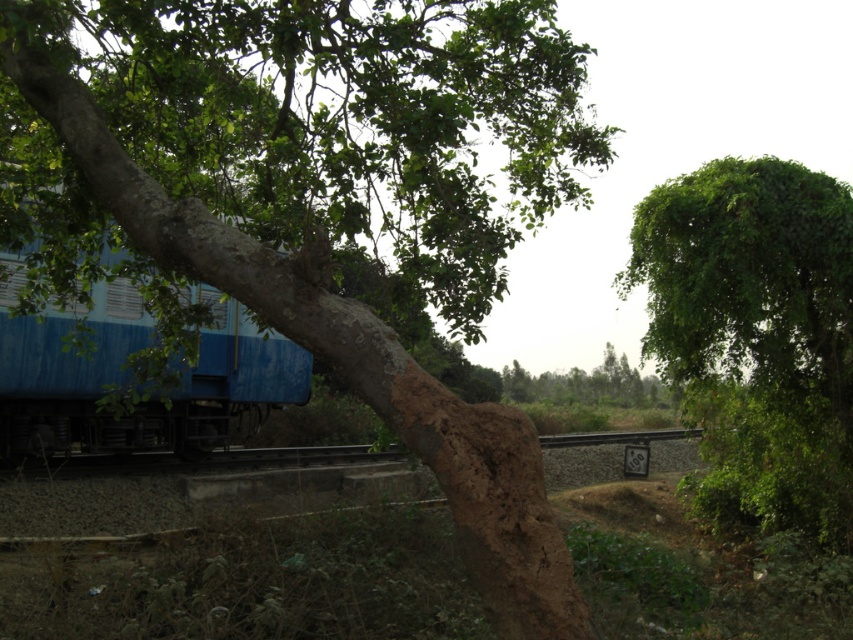
Question: Which object appears closest to the camera in this image?

Choices:
 (A) green leafy tree at upper right
 (B) brown rough bark tree at center

Answer: (B)

Question: Does brown rough bark tree at center have a larger size compared to green leafy tree at upper right?

Choices:
 (A) yes
 (B) no

Answer: (A)

Question: Which object is closer to the camera taking this photo?

Choices:
 (A) green leafy tree at upper right
 (B) blue matte train at left

Answer: (A)

Question: Is green leafy tree at upper right to the left of blue matte train at left from the viewer's perspective?

Choices:
 (A) no
 (B) yes

Answer: (A)

Question: Where is green leafy tree at upper right located in relation to blue matte train at left in the image?

Choices:
 (A) below
 (B) above

Answer: (A)

Question: Which object appears closest to the camera in this image?

Choices:
 (A) blue matte train at left
 (B) green leafy tree at upper right
 (C) brown rough bark tree at center

Answer: (C)